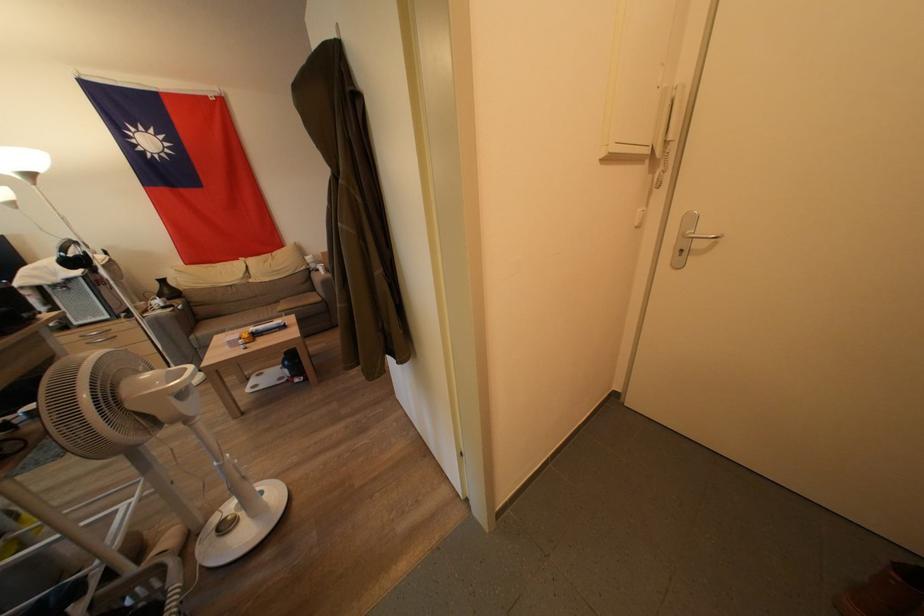
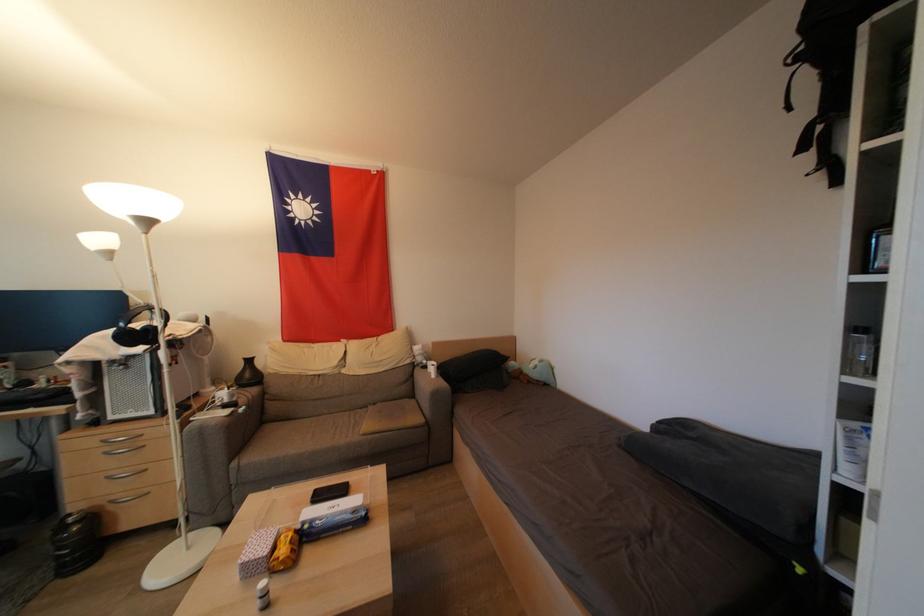
Where in the second image is the point corresponding to (246,342) from the first image?

(277, 553)